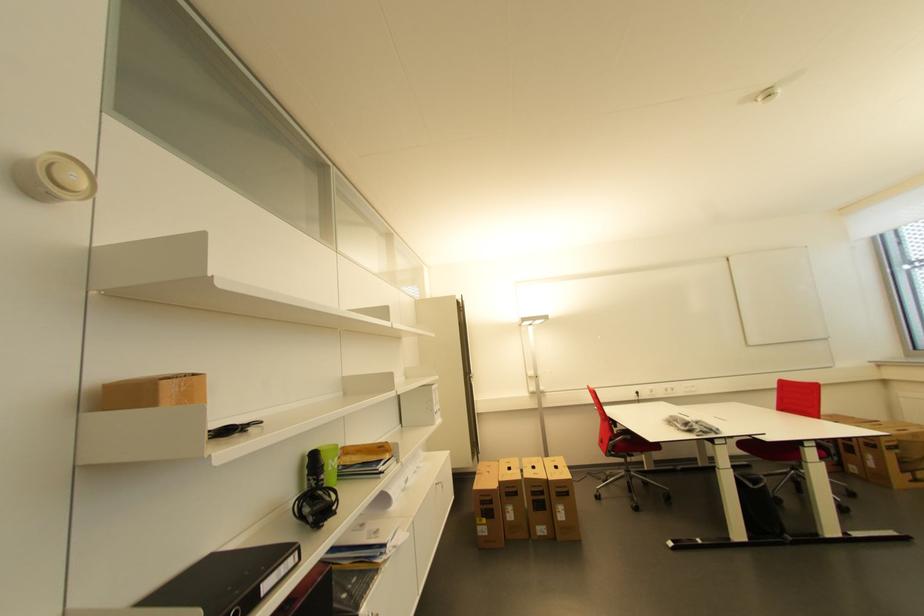
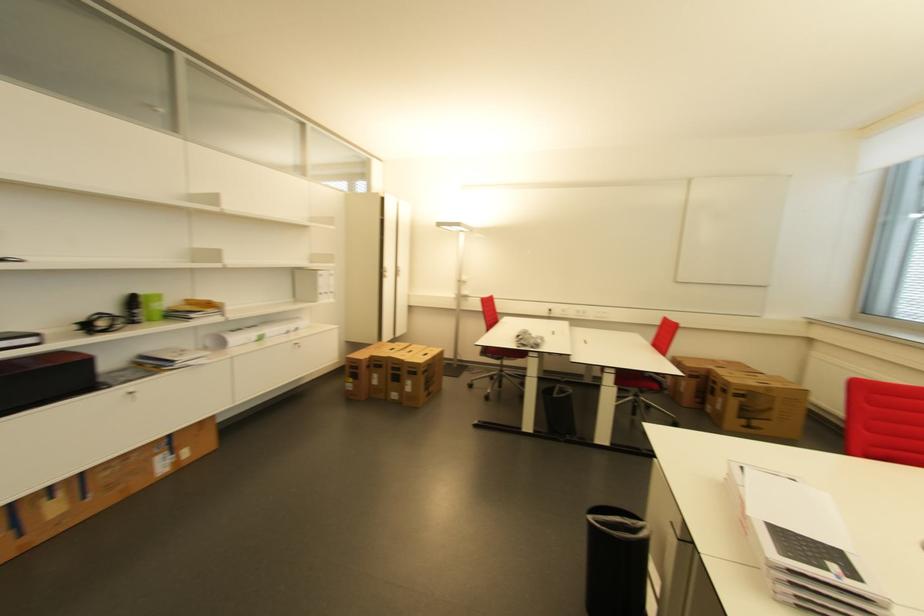
The point at (496, 503) is marked in the first image. Where is the corresponding point in the second image?

(362, 369)